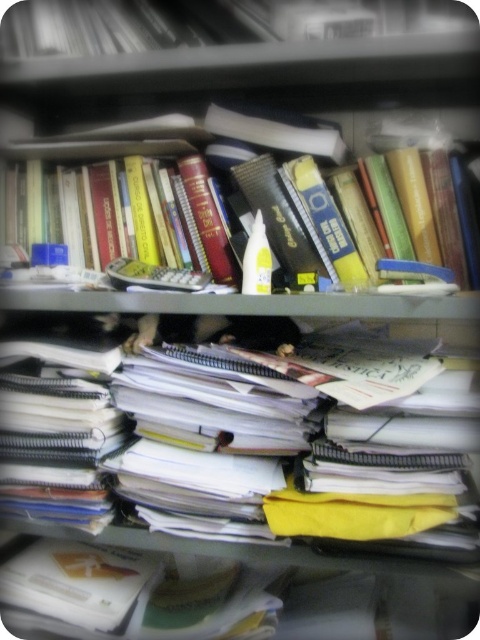
Question: Which point is farther to the camera?

Choices:
 (A) (153, 198)
 (B) (348, 532)

Answer: (A)

Question: Does white paper notebook at center have a smaller size compared to hardcover book at upper left?

Choices:
 (A) yes
 (B) no

Answer: (B)

Question: Is white paper notebook at center below hardcover book at upper left?

Choices:
 (A) yes
 (B) no

Answer: (A)

Question: Can you confirm if white paper notebook at center is thinner than hardcover book at upper left?

Choices:
 (A) yes
 (B) no

Answer: (A)

Question: Among these objects, which one is farthest from the camera?

Choices:
 (A) white paper notebook at center
 (B) hardcover book at upper left

Answer: (B)